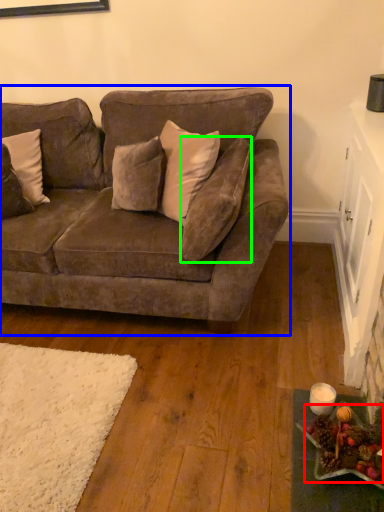
Question: Estimate the real-world distances between objects in this image. Which object is closer to food (highlighted by a red box), studio couch (highlighted by a blue box) or pillow (highlighted by a green box)?

Choices:
 (A) studio couch
 (B) pillow

Answer: (B)